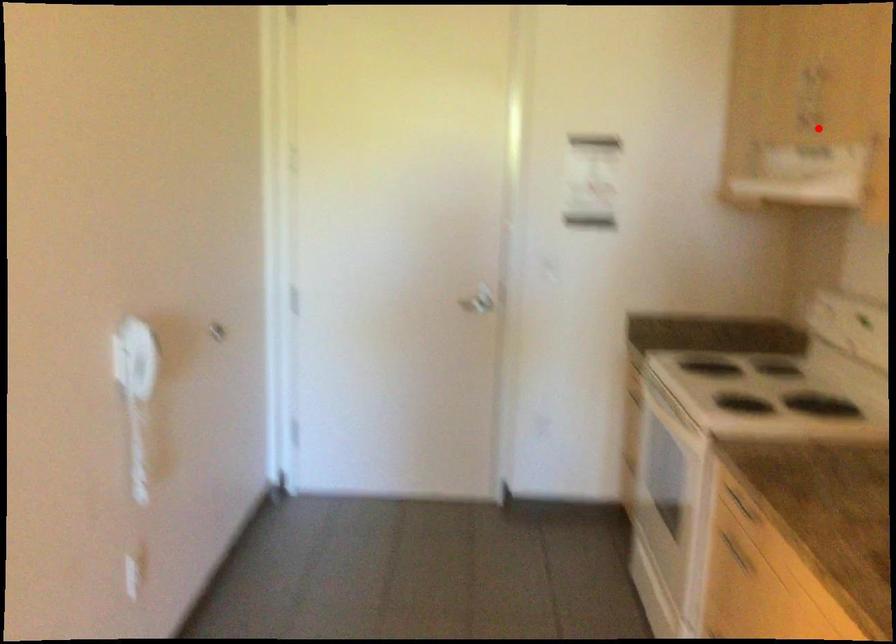
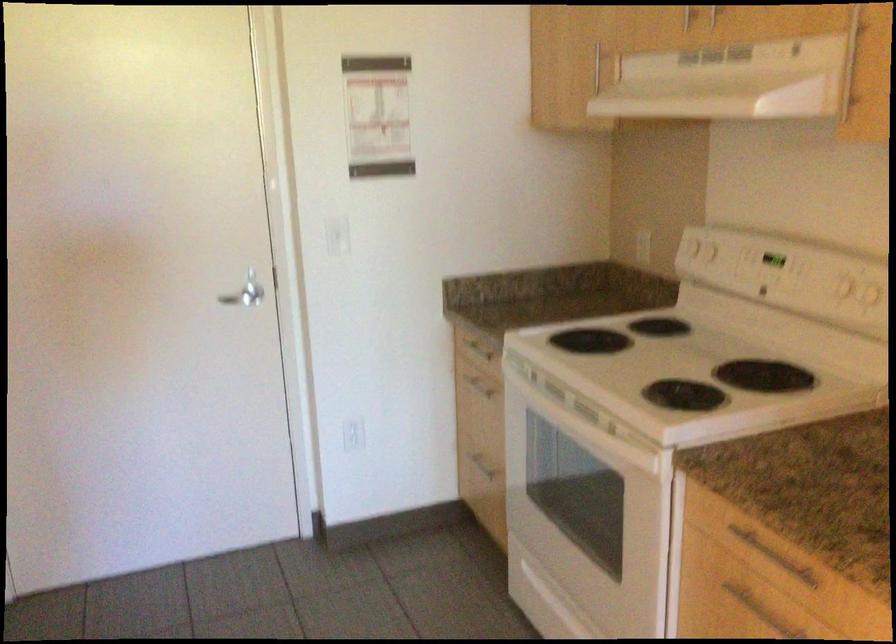
Question: I am providing you with two images of the same scene from different viewpoints. In image1, a red point is highlighted. Considering the same 3D point in image2, which of the following is correct?

Choices:
 (A) It is closer
 (B) It is farther

Answer: (A)